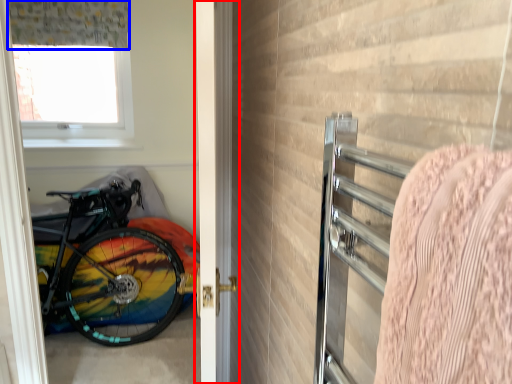
Question: Which point is further to the camera, door (highlighted by a red box) or curtain (highlighted by a blue box)?

Choices:
 (A) door
 (B) curtain

Answer: (B)